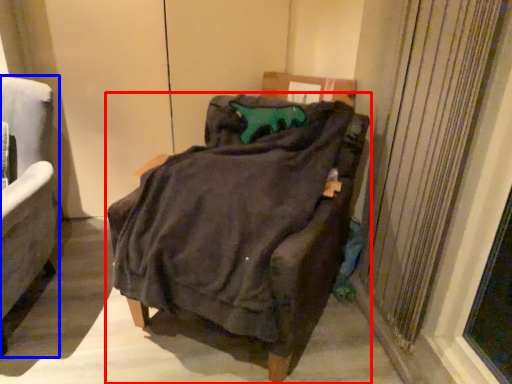
Question: Which object is further to the camera taking this photo, chair (highlighted by a red box) or chair (highlighted by a blue box)?

Choices:
 (A) chair
 (B) chair

Answer: (B)